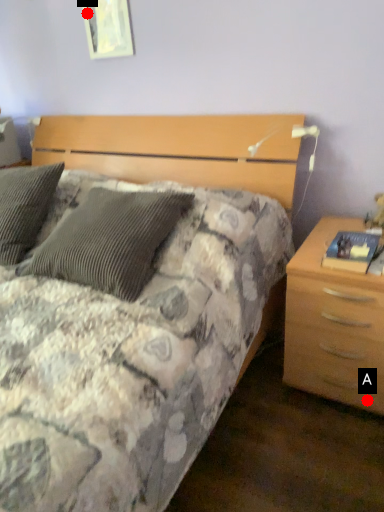
Question: Two points are circled on the image, labeled by A and B beside each circle. Among these points, which one is nearest to the camera?

Choices:
 (A) A is closer
 (B) B is closer

Answer: (A)